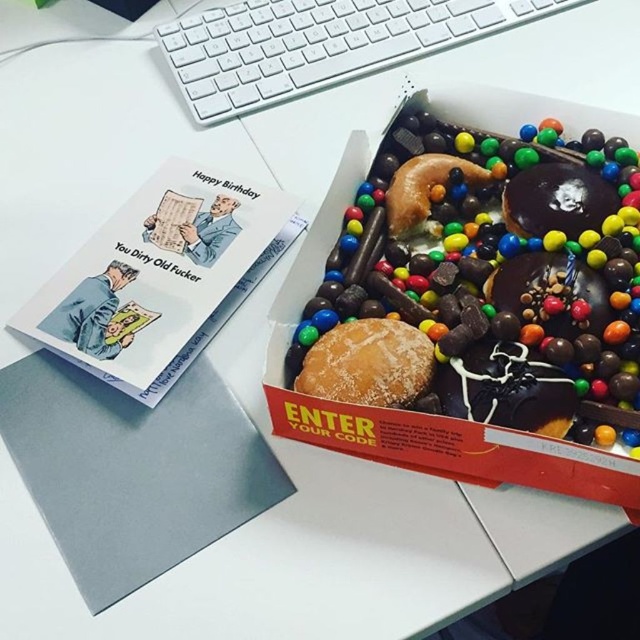
Question: Among these points, which one is farthest from the camera?

Choices:
 (A) (264, 81)
 (B) (390, 195)
 (C) (410, 376)
 (D) (518, 260)

Answer: (A)

Question: Can you confirm if multicolored chocolate-coated candies at center is positioned to the right of white plastic keyboard at upper center?

Choices:
 (A) yes
 (B) no

Answer: (A)

Question: Which of the following is the closest to the observer?

Choices:
 (A) chocolate glazed donut at upper center
 (B) multicolored chocolate-coated candies at center
 (C) white plastic keyboard at upper center

Answer: (B)

Question: Is white plastic keyboard at upper center positioned behind powdered sugar bun at center?

Choices:
 (A) no
 (B) yes

Answer: (B)

Question: Which is nearer to the white plastic keyboard at upper center?

Choices:
 (A) multicolored chocolate-coated candies at center
 (B) chocolate glazed donut at upper center

Answer: (B)

Question: Is multicolored chocolate-coated candies at center positioned before chocolate glazed donut at upper center?

Choices:
 (A) no
 (B) yes

Answer: (B)